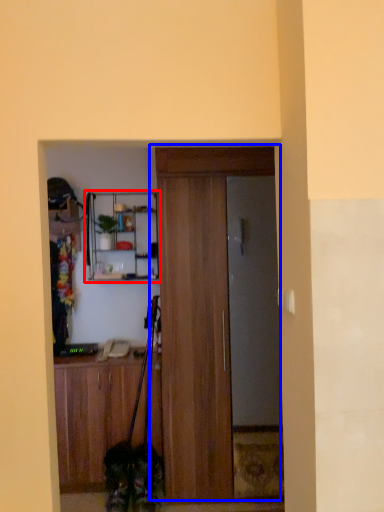
Question: Among these objects, which one is farthest to the camera, shelf (highlighted by a red box) or door (highlighted by a blue box)?

Choices:
 (A) shelf
 (B) door

Answer: (A)